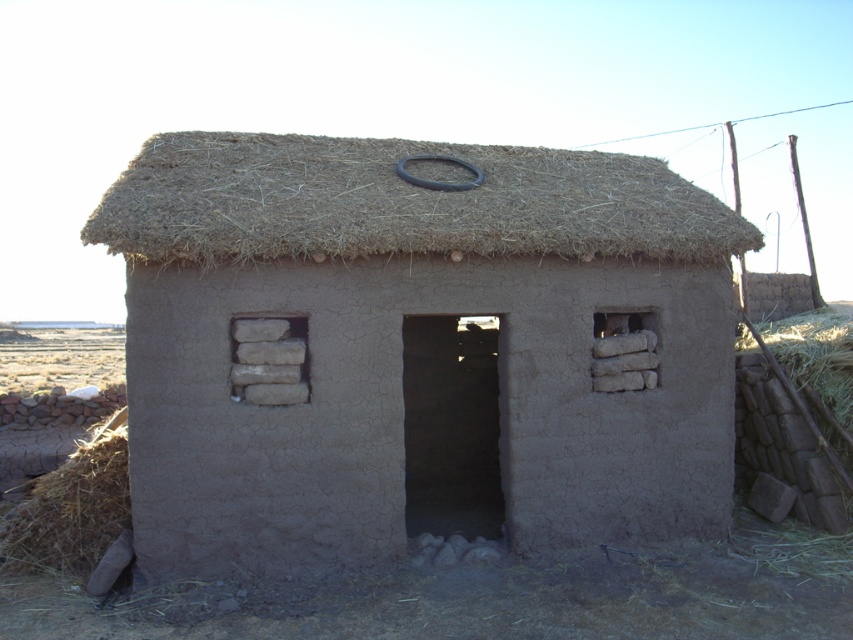
You are standing in front of the mud brick structure and want to determine the relative positions of two points marked on the roof. Which point is closer to you, point (705, 196) or point (28, 518)?

Point (28, 518) is closer to you because it is less further to the camera than point (705, 196).

You are a construction worker inspecting the roof of the mud brick building. You notice two materials used in the roof structure. Which material is taller between the brown thatch at center and the brown straw at lower left?

The brown thatch at center is much taller than the brown straw at lower left according to the description.